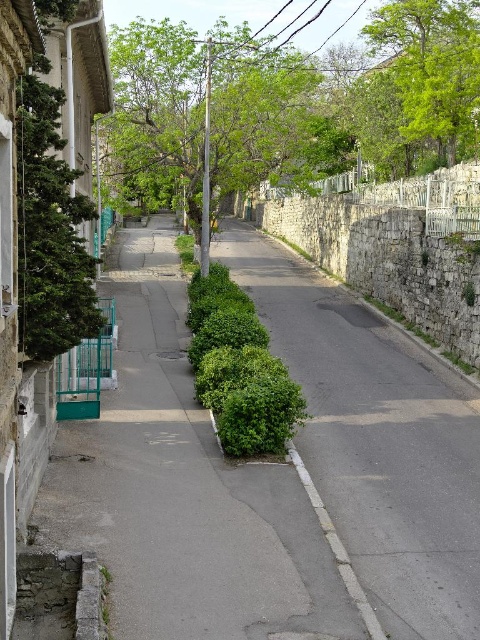
Which is more to the left, green leafy tree at upper center or green leafy tree at left?

green leafy tree at left is more to the left.

Does green leafy tree at upper center have a smaller size compared to green leafy tree at left?

No.

Between point (132, 93) and point (84, 253), which one is positioned in front?

Point (84, 253) is more forward.

Identify the location of green leafy tree at upper center. The image size is (480, 640). (204, 115).

Can you confirm if green leafy tree at upper center is bigger than green leafy tree at upper right?

Indeed, green leafy tree at upper center has a larger size compared to green leafy tree at upper right.

Measure the distance between green leafy tree at upper center and green leafy tree at upper right.

green leafy tree at upper center is 6.26 meters from green leafy tree at upper right.

Identify the location of green leafy tree at upper center. (204, 115).

Does point (391, 349) come in front of point (368, 33)?

Yes, point (391, 349) is closer to viewer.

Can you confirm if green leafy bush at center is taller than green leafy tree at upper right?

In fact, green leafy bush at center may be shorter than green leafy tree at upper right.

Find the location of a particular element. green leafy bush at center is located at coordinates (375, 440).